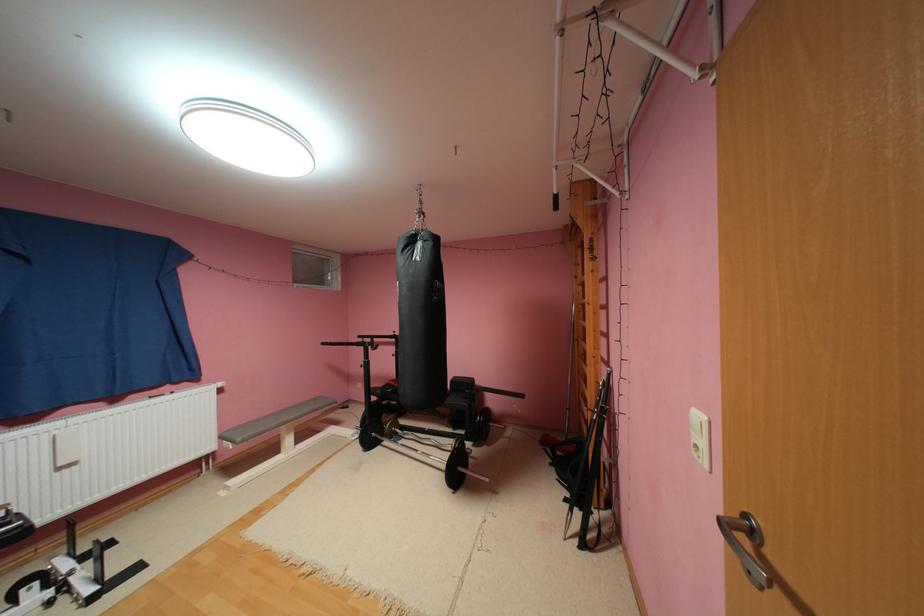
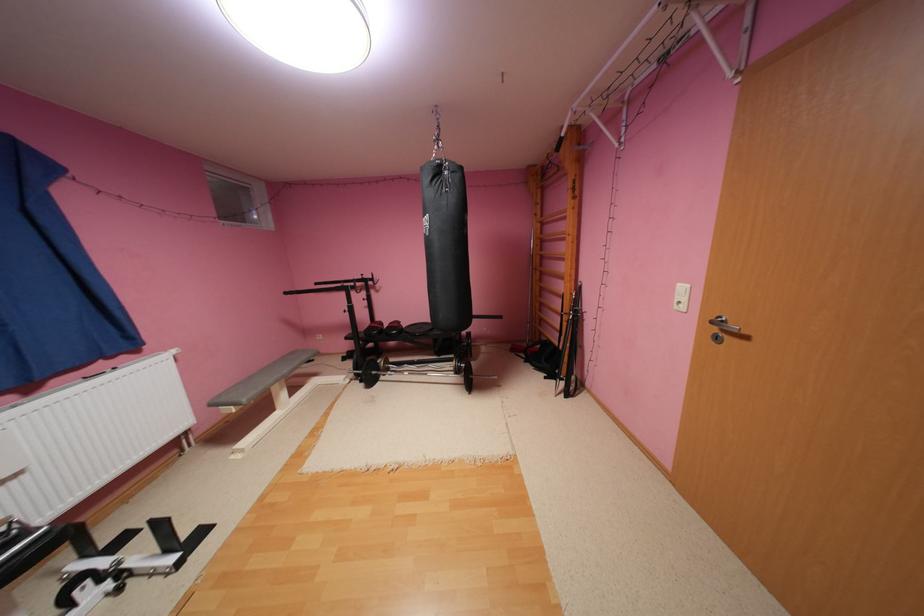
Question: The camera is either moving clockwise (left) or counter-clockwise (right) around the object. The first image is from the beginning of the video and the second image is from the end. Is the camera moving left or right when shooting the video?

Choices:
 (A) Left
 (B) Right

Answer: (A)